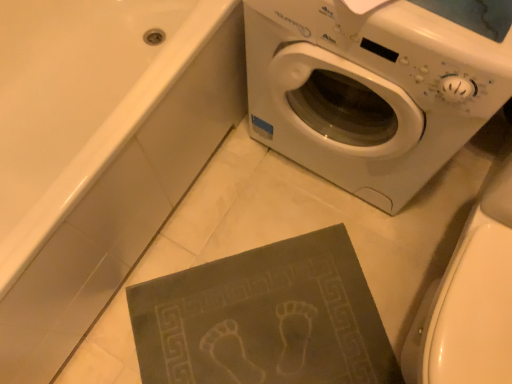
Find the location of a particular element. The height and width of the screenshot is (384, 512). free space above dark gray textured mat at lower center (from a real-world perspective) is located at coordinates (256, 324).